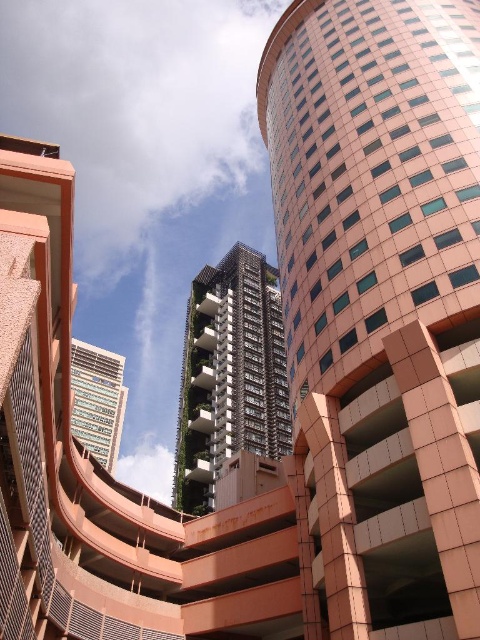
You are an architect evaluating the urban layout. Given the pink tile building at center and the green textured building at center, which one would cast a longer shadow during midday in this urban setting?

The pink tile building at center is much taller than the green textured building at center, so it would cast a longer shadow during midday.

You are standing in front of the modern urban landscape and want to determine the visibility of two points marked in the image. Which of the two points, point (379, 58) or point (81, 422), is more visible to you from your current position?

Point (379, 58) is closer to the viewer than point (81, 422), so it is more visible.